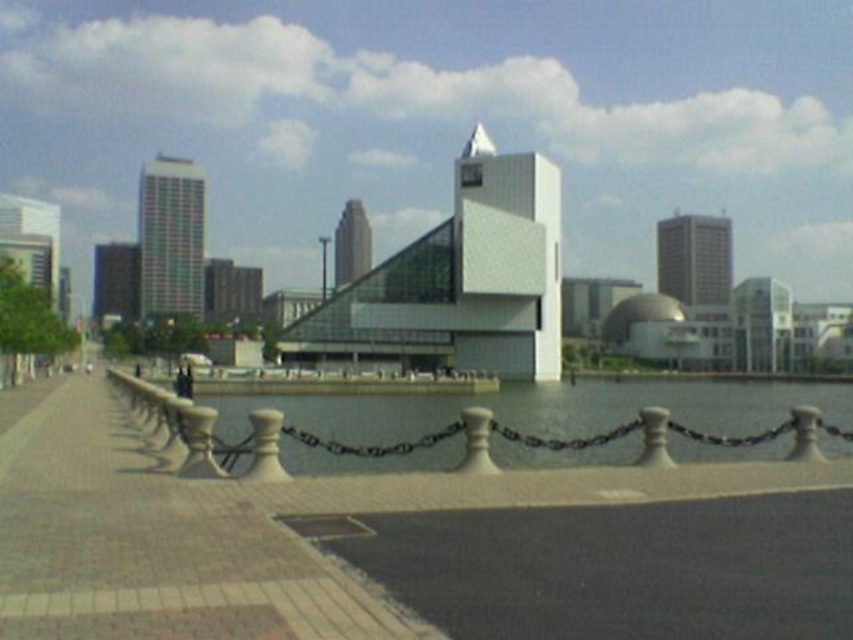
Identify the location of concrete paving at center. This screenshot has height=640, width=853. (160, 541).

Can you confirm if concrete paving at center is positioned below clear glass water at center?

No.

Is point (141, 611) positioned behind point (422, 458)?

No, (141, 611) is in front of (422, 458).

Identify the location of concrete paving at center. [160, 541].